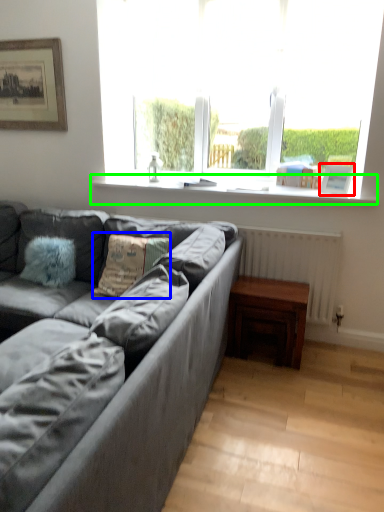
Question: Which object is positioned farthest from picture frame (highlighted by a red box)? Select from pillow (highlighted by a blue box) and window sill (highlighted by a green box).

Choices:
 (A) pillow
 (B) window sill

Answer: (A)